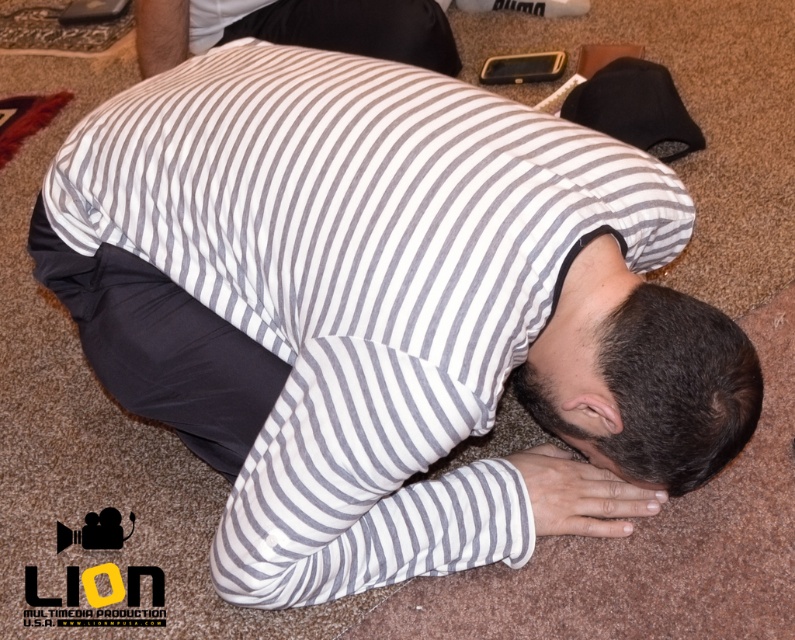
Is gray striped shirt at center further to camera compared to dark brown hair at center?

No.

Does point (415, 461) come in front of point (731, 384)?

No, (415, 461) is behind (731, 384).

Where is `gray striped shirt at center`? This screenshot has height=640, width=795. gray striped shirt at center is located at coordinates (359, 285).

Is gray striped shirt at center smaller than white striped pillow at center?

Actually, gray striped shirt at center might be larger than white striped pillow at center.

Where is `gray striped shirt at center`? The height and width of the screenshot is (640, 795). gray striped shirt at center is located at coordinates (359, 285).

Between point (223, 275) and point (324, 8), which one is positioned in front?

Point (223, 275) is more forward.

Identify the location of gray striped shirt at center. The width and height of the screenshot is (795, 640). (359, 285).

From the picture: Who is lower down, dark brown hair at center or white striped pillow at center?

dark brown hair at center is below.

Between dark brown hair at center and white striped pillow at center, which one has less height?

white striped pillow at center

In order to click on dark brown hair at center in this screenshot , I will do `click(662, 388)`.